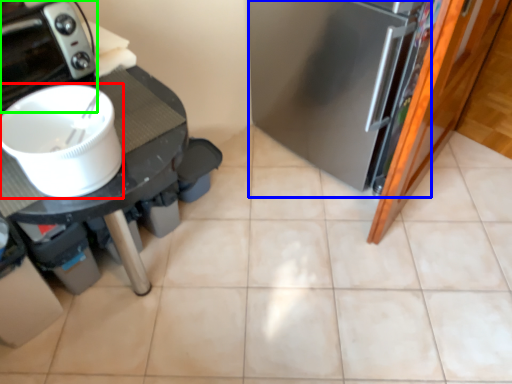
Question: Based on their relative distances, which object is nearer to kitchen appliance (highlighted by a red box)? Choose from fridge (highlighted by a blue box) and home appliance (highlighted by a green box).

Choices:
 (A) fridge
 (B) home appliance

Answer: (B)